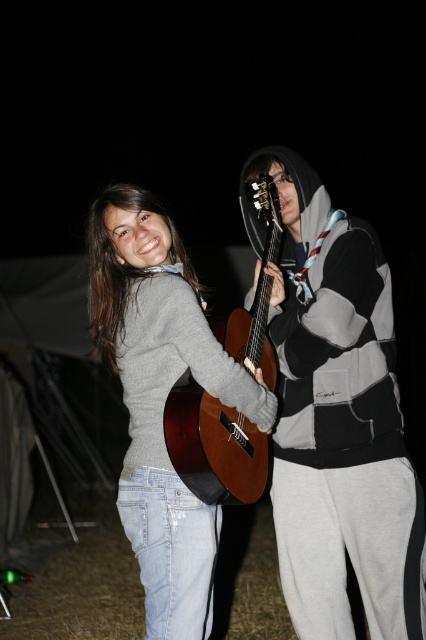
Consider the image. Is matte black hoodie at center wider than wooden acoustic guitar at center?

Yes.

Is matte black hoodie at center shorter than wooden acoustic guitar at center?

No, matte black hoodie at center is not shorter than wooden acoustic guitar at center.

Which is behind, point (307, 432) or point (172, 464)?

Positioned behind is point (307, 432).

Where is `matte black hoodie at center`? The height and width of the screenshot is (640, 426). matte black hoodie at center is located at coordinates (337, 420).

Which of these two, matte gray sweater at center or wooden acoustic guitar at center, stands shorter?

A: wooden acoustic guitar at center is shorter.

Who is positioned more to the left, matte gray sweater at center or wooden acoustic guitar at center?

matte gray sweater at center

You are a GUI agent. You are given a task and a screenshot of the screen. Output one action in this format:
    pyautogui.click(x=<x>, y=<y>)
    Task: Click on the matte gray sweater at center
    This screenshot has width=426, height=640.
    Given the screenshot: What is the action you would take?
    pyautogui.click(x=161, y=397)

Is matte black hoodie at center further to camera compared to matte gray sweater at center?

Yes, matte black hoodie at center is behind matte gray sweater at center.

Is matte black hoodie at center wider than matte gray sweater at center?

In fact, matte black hoodie at center might be narrower than matte gray sweater at center.

Is point (383, 512) farther from viewer compared to point (195, 368)?

Yes.

At what (x,y) coordinates should I click in order to perform the action: click on matte black hoodie at center. Please return your answer as a coordinate pair (x, y). The width and height of the screenshot is (426, 640). Looking at the image, I should click on (337, 420).